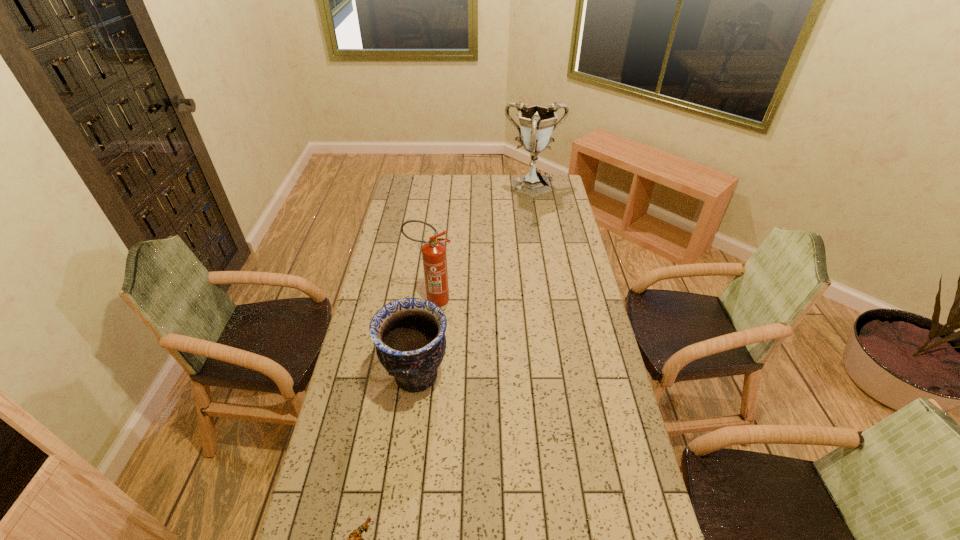
The width and height of the screenshot is (960, 540). Identify the location of object that is at the right edge. (537, 123).

I want to click on object that is at the far right corner, so click(x=537, y=123).

In order to click on vacant region at the left edge in this screenshot , I will do 382,246.

The image size is (960, 540). I want to click on vacant point at the right edge, so click(575, 322).

The image size is (960, 540). I want to click on free region at the far left corner of the desktop, so click(418, 195).

The image size is (960, 540). Find the location of `free space between the rightmost object and the fire extinguisher`. free space between the rightmost object and the fire extinguisher is located at coordinates (483, 244).

Find the location of `free space between the trophy cup and the third nearest object`. free space between the trophy cup and the third nearest object is located at coordinates (483, 244).

Locate which object is the third closest to the figurine. Please provide its 2D coordinates. Your answer should be formatted as a tuple, i.e. [(x, y)], where the tuple contains the x and y coordinates of a point satisfying the conditions above.

[(537, 123)]

The image size is (960, 540). What are the coordinates of `object that stands as the second closest to the nearest object` in the screenshot? It's located at (434, 257).

Find the location of a particular element. free space that satisfies the following two spatial constraints: 1. on the front side of the rightmost object; 2. on the front handle of the second nearest object is located at coordinates (565, 376).